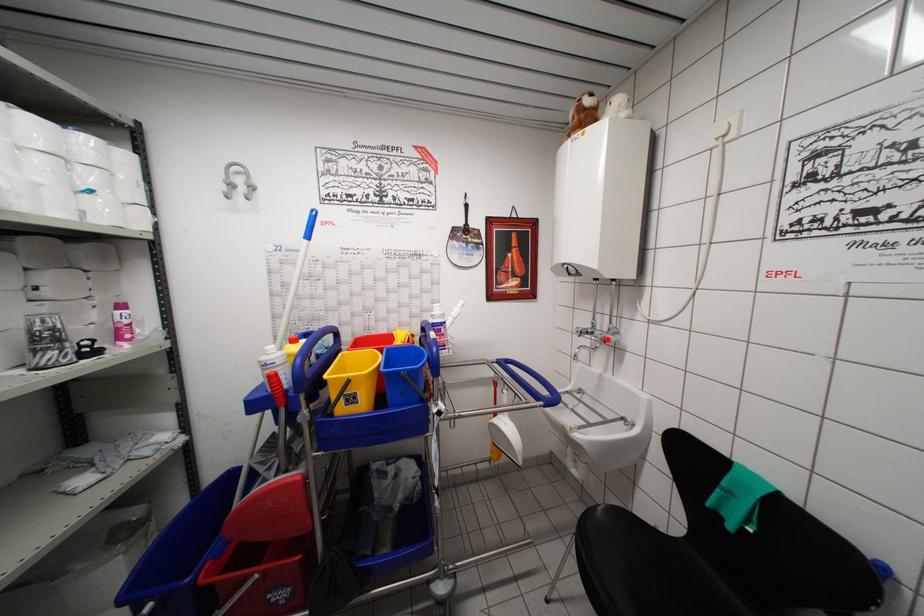
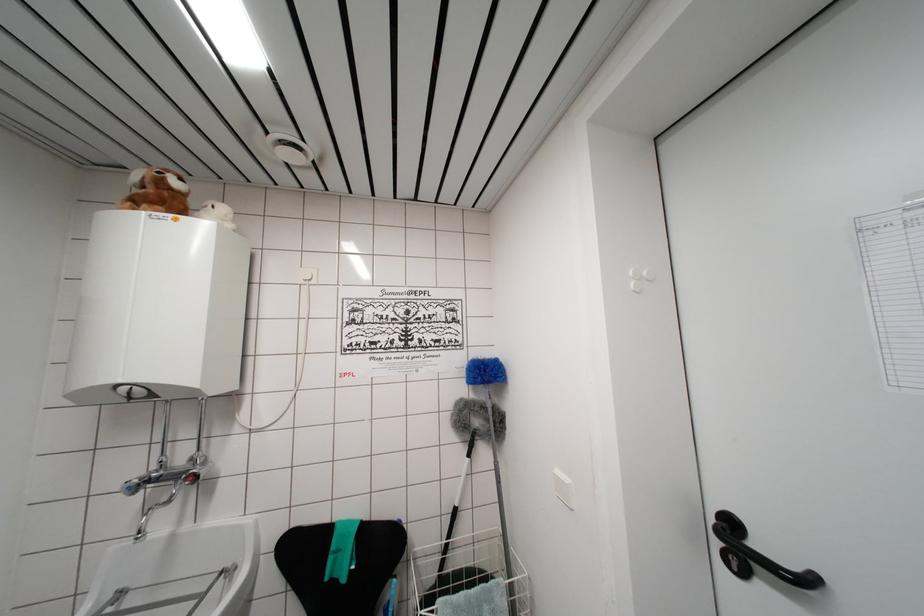
Locate, in the second image, the point that corresponds to the highlighted location in the first image.

(197, 476)